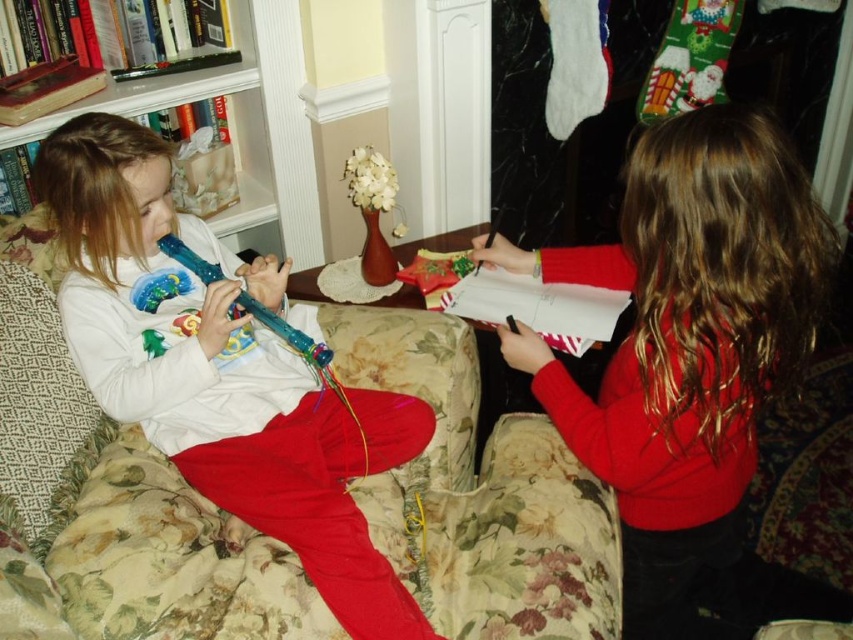
You are a photographer trying to capture a closeup of the translucent plastic flute at left and the matte red sweater at right. Which object should you focus on first if you want to ensure both are in focus without moving the camera?

The matte red sweater at right is below the translucent plastic flute at left, so you should focus on the translucent plastic flute at left first since it is closer to the camera. This will ensure the sweater, being further away, remains in focus as well.

You are a photographer setting up for a family photo. You need to ensure that both the matte red sweater at right and the translucent plastic flute at left are clearly visible in the shot. Based on their positions, will the photographer need to adjust the camera angle to avoid one blocking the other?

The matte red sweater at right is in front of the translucent plastic flute at left, so the photographer will need to adjust the camera angle to ensure both are visible without one blocking the other.

You are a tailor measuring fabrics for alterations. You have a piece of fabric that is exactly the same width as the translucent plastic flute at left. Can you use this fabric to make a new sleeve for the matte red sweater at right without needing to adjust the fabric size?

The matte red sweater at right is wider than the translucent plastic flute at left. Since the fabric is only as wide as the flute, it would not be sufficient to cover the sleeve of the wider sweater without adjustments.